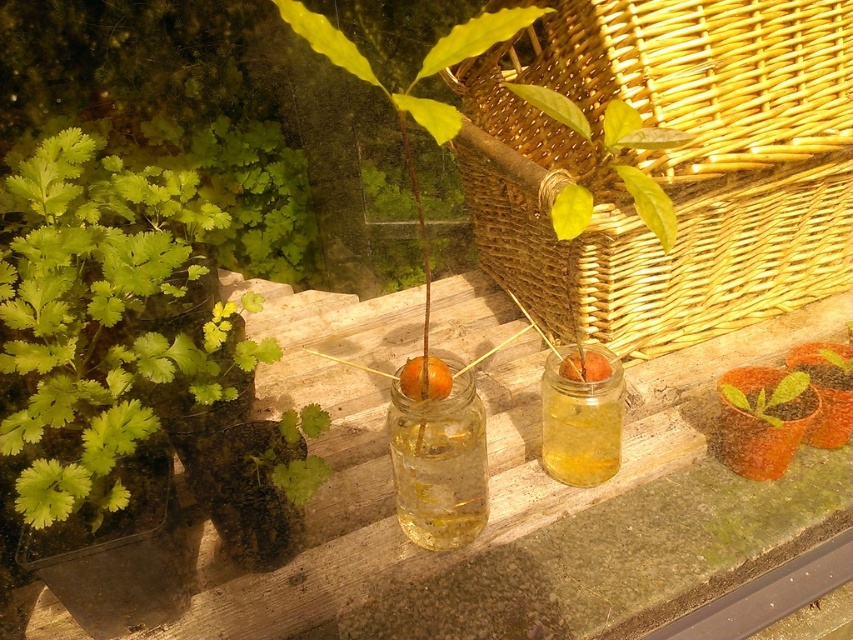
You are a botanist studying plant propagation methods. You observe two glass jars on a wooden surface. One contains a green leafy plant at upper center marked by point (618, 150). The other jar has a similar plant but with a small orange fruit attached at the base. Which jar has the plant with the orange fruit?

The jar with the plant that has the small orange fruit attached at the base is the one not marked by point (618, 150), since the marked point indicates the green leafy plant at upper center without mentioning the fruit.

You are a gardener who needs to place a 12 inch long gardening tool between the woven wicker basket at upper right and the green leafy plant at center. Will the tool fit in the space between them?

The distance between the woven wicker basket at upper right and the green leafy plant at center is 13.70 inches, so yes, the 12 inch long gardening tool will fit in the space between them since it is shorter than the available distance.